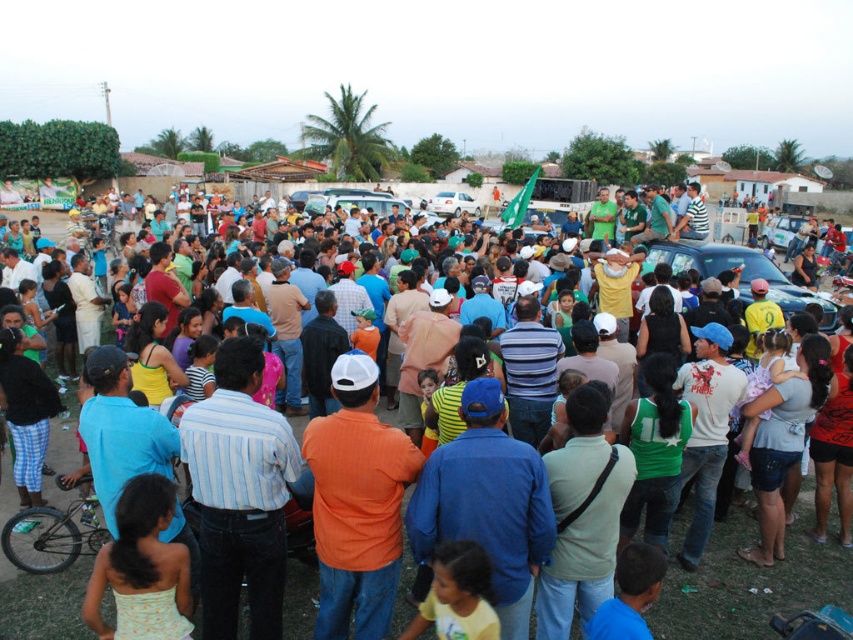
Can you confirm if matte blue shirt at center is positioned to the left of metallic blue car at center?

Correct, you'll find matte blue shirt at center to the left of metallic blue car at center.

Is point (675, 540) positioned behind point (764, 253)?

No, (675, 540) is closer to viewer.

Where is `matte blue shirt at center`? matte blue shirt at center is located at coordinates (747, 580).